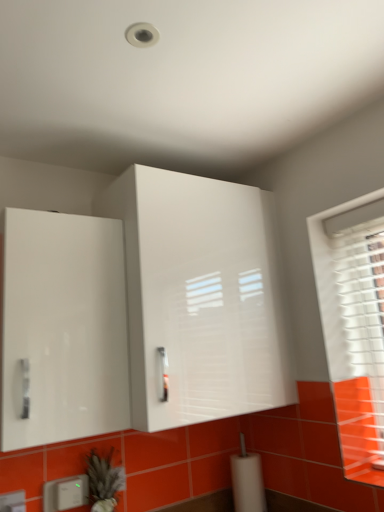
Question: Is white plastic electric outlet at lower left, acting as the second electric outlet starting from the front, bigger than white plastic electric outlet at lower left, which ranks as the first electric outlet in front-to-back order?

Choices:
 (A) yes
 (B) no

Answer: (A)

Question: Is white plastic electric outlet at lower left, which ranks as the 1th electric outlet in back-to-front order, to the left of white plastic electric outlet at lower left, marked as the 2th electric outlet in a right-to-left arrangement, from the viewer's perspective?

Choices:
 (A) yes
 (B) no

Answer: (B)

Question: Is white plastic electric outlet at lower left, arranged as the second electric outlet when viewed from the left, not inside white plastic electric outlet at lower left, which appears as the first electric outlet when viewed from the left?

Choices:
 (A) no
 (B) yes

Answer: (B)

Question: Can you confirm if white plastic electric outlet at lower left, positioned as the first electric outlet in right-to-left order, is positioned to the right of white plastic electric outlet at lower left, which ranks as the first electric outlet in front-to-back order?

Choices:
 (A) no
 (B) yes

Answer: (B)

Question: Are white plastic electric outlet at lower left, acting as the second electric outlet starting from the front, and white plastic electric outlet at lower left, which appears as the first electric outlet when viewed from the left, beside each other?

Choices:
 (A) no
 (B) yes

Answer: (A)

Question: From a real-world perspective, is white glossy cabinet at left, the second cabinetry positioned from the right, physically located above or below white glossy cabinet at upper center, the 2th cabinetry in the left-to-right sequence?

Choices:
 (A) below
 (B) above

Answer: (A)

Question: In the image, is white glossy cabinet at left, the first cabinetry in the left-to-right sequence, positioned in front of or behind white glossy cabinet at upper center, the 2th cabinetry in the left-to-right sequence?

Choices:
 (A) front
 (B) behind

Answer: (A)

Question: Which is correct: white glossy cabinet at left, the first cabinetry in the left-to-right sequence, is inside white glossy cabinet at upper center, placed as the first cabinetry when sorted from right to left, or outside of it?

Choices:
 (A) outside
 (B) inside

Answer: (A)

Question: Does point (61, 239) appear closer or farther from the camera than point (258, 329)?

Choices:
 (A) closer
 (B) farther

Answer: (A)

Question: Does point (188, 362) appear closer or farther from the camera than point (114, 485)?

Choices:
 (A) farther
 (B) closer

Answer: (B)

Question: Is white glossy cabinet at upper center, placed as the first cabinetry when sorted from right to left, in front of or behind green fuzzy plant at lower left in the image?

Choices:
 (A) behind
 (B) front

Answer: (B)

Question: Which is correct: white glossy cabinet at upper center, the 2th cabinetry in the left-to-right sequence, is inside green fuzzy plant at lower left, or outside of it?

Choices:
 (A) inside
 (B) outside

Answer: (B)

Question: Visually, is white glossy cabinet at upper center, placed as the first cabinetry when sorted from right to left, positioned to the left or to the right of green fuzzy plant at lower left?

Choices:
 (A) right
 (B) left

Answer: (A)

Question: Which is correct: white glossy cabinet at upper center, the 2th cabinetry in the left-to-right sequence, is inside white plastic electric outlet at lower left, which ranks as the first electric outlet in front-to-back order, or outside of it?

Choices:
 (A) outside
 (B) inside

Answer: (A)

Question: Considering their positions, is white glossy cabinet at upper center, placed as the first cabinetry when sorted from right to left, located in front of or behind white plastic electric outlet at lower left, arranged as the 2th electric outlet when viewed from the back?

Choices:
 (A) front
 (B) behind

Answer: (A)